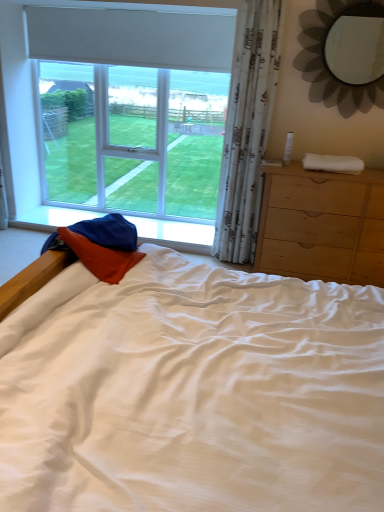
Question: Considering their positions, is white matte window at upper left located in front of or behind white sheer curtain at right?

Choices:
 (A) behind
 (B) front

Answer: (A)

Question: From a real-world perspective, relative to white sheer curtain at right, is white matte window at upper left vertically above or below?

Choices:
 (A) above
 (B) below

Answer: (B)

Question: Considering the real-world distances, which object is closest to the white matte window at upper left?

Choices:
 (A) metallic flower-shaped mirror at upper right
 (B) white sheer curtain at right
 (C) white soft towel at right
 (D) light brown wooden chest of drawers at right

Answer: (B)

Question: Which is farther from the white matte window at upper left?

Choices:
 (A) metallic flower-shaped mirror at upper right
 (B) white sheer curtain at right
 (C) light brown wooden chest of drawers at right
 (D) white soft towel at right

Answer: (D)